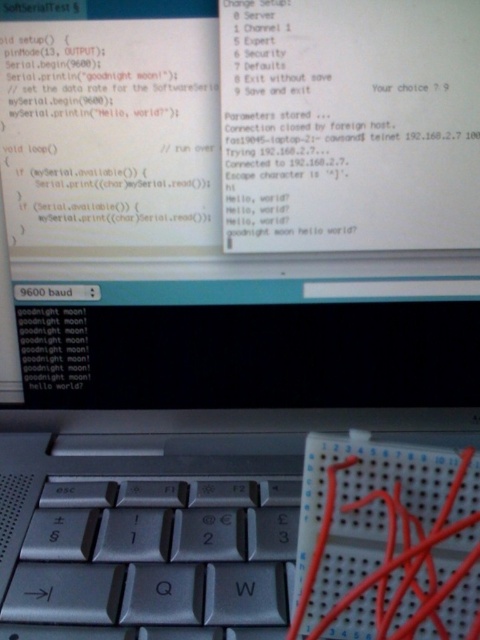
Question: Can you confirm if silver metallic keyboard at center is bigger than red plastic wire at center?

Choices:
 (A) yes
 (B) no

Answer: (A)

Question: Which object appears closest to the camera in this image?

Choices:
 (A) red plastic wire at center
 (B) silver metallic keyboard at center

Answer: (A)

Question: Which point appears closest to the camera in this image?

Choices:
 (A) (60, 620)
 (B) (478, 600)

Answer: (B)

Question: Can you confirm if silver metallic keyboard at center is thinner than red plastic wire at center?

Choices:
 (A) yes
 (B) no

Answer: (B)

Question: Does silver metallic keyboard at center appear over red plastic wire at center?

Choices:
 (A) no
 (B) yes

Answer: (A)